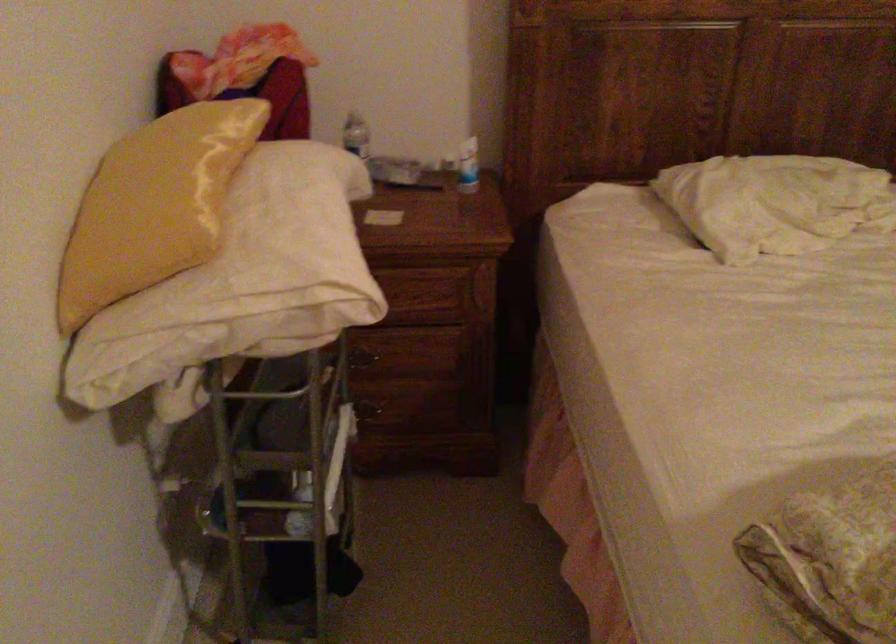
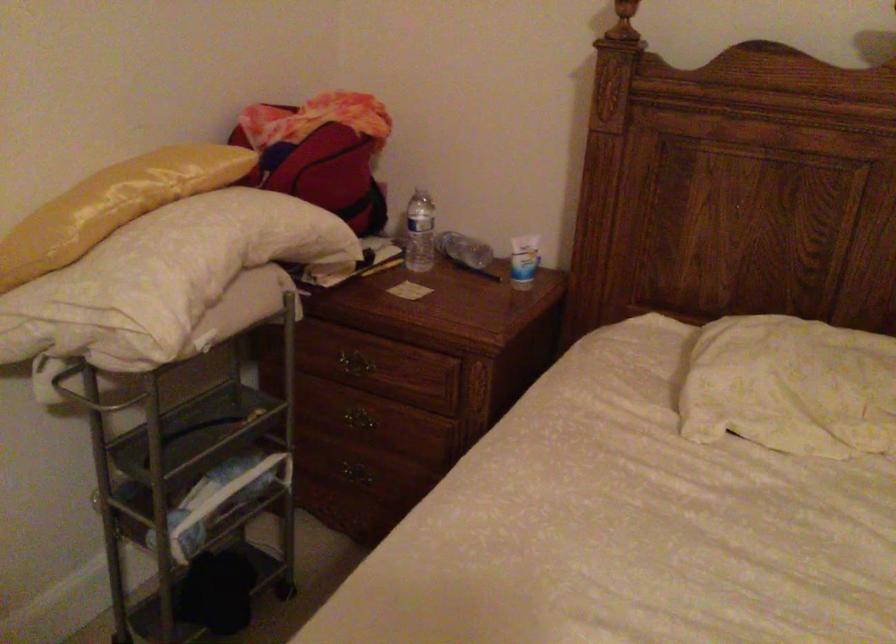
In the second image, find the point that corresponds to [216,185] in the first image.

(113, 205)